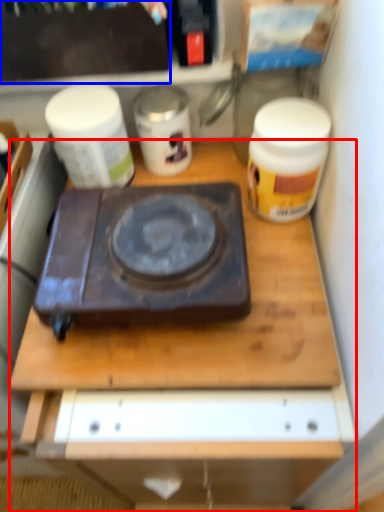
Question: Among these objects, which one is nearest to the camera, desk (highlighted by a red box) or box (highlighted by a blue box)?

Choices:
 (A) desk
 (B) box

Answer: (A)